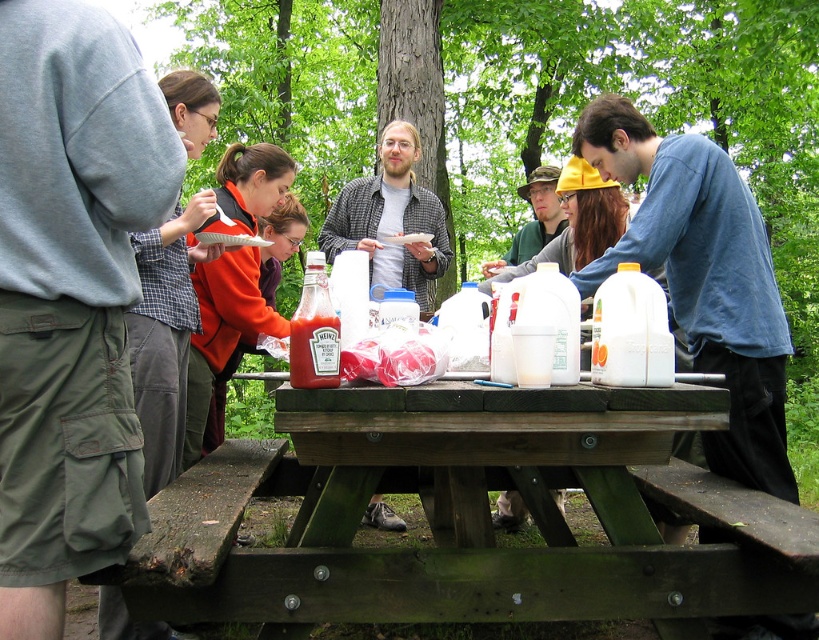
Can you confirm if orange fleece jacket at center is taller than plaid shirt at center?

Indeed, orange fleece jacket at center has a greater height compared to plaid shirt at center.

Is point (260, 196) farther from camera compared to point (388, 221)?

No, it is not.

Find the location of a particular element. orange fleece jacket at center is located at coordinates (222, 332).

Between green wood picnic table at center and orange fleece jacket at center, which one has more height?

orange fleece jacket at center

Can you confirm if green wood picnic table at center is wider than orange fleece jacket at center?

Indeed, green wood picnic table at center has a greater width compared to orange fleece jacket at center.

Between point (460, 464) and point (201, 284), which one is positioned in front?

Positioned in front is point (460, 464).

The width and height of the screenshot is (819, 640). Identify the location of green wood picnic table at center. (492, 426).

Who is positioned more to the right, green wood picnic table at center or white plastic bag at center?

From the viewer's perspective, green wood picnic table at center appears more on the right side.

Can you confirm if green wood picnic table at center is positioned above white plastic bag at center?

Incorrect, green wood picnic table at center is not positioned above white plastic bag at center.

Does point (629, 448) come behind point (406, 234)?

No, it is not.

At what (x,y) coordinates should I click in order to perform the action: click on green wood picnic table at center. Please return your answer as a coordinate pair (x, y). This screenshot has height=640, width=819. Looking at the image, I should click on (492, 426).